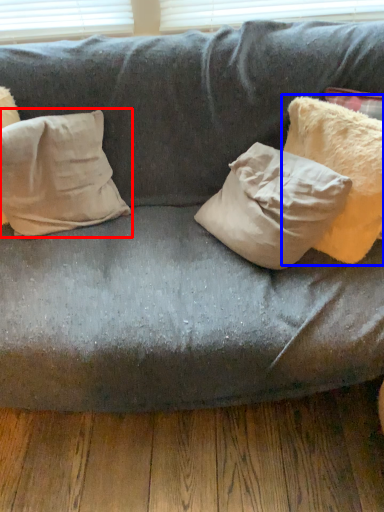
Question: Which of the following is the farthest to the observer, pillow (highlighted by a red box) or pillow (highlighted by a blue box)?

Choices:
 (A) pillow
 (B) pillow

Answer: (A)